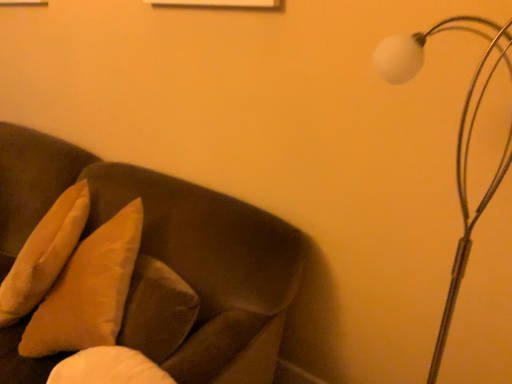
Question: Considering the relative sizes of white matte lamp at upper right and soft beige pillow at left in the image provided, is white matte lamp at upper right wider than soft beige pillow at left?

Choices:
 (A) yes
 (B) no

Answer: (B)

Question: From a real-world perspective, does white matte lamp at upper right sit lower than soft beige pillow at left?

Choices:
 (A) yes
 (B) no

Answer: (B)

Question: Is white matte lamp at upper right completely or partially outside of soft beige pillow at left?

Choices:
 (A) no
 (B) yes

Answer: (B)

Question: Does white matte lamp at upper right touch soft beige pillow at left?

Choices:
 (A) no
 (B) yes

Answer: (A)

Question: Is white matte lamp at upper right thinner than soft beige pillow at left?

Choices:
 (A) no
 (B) yes

Answer: (B)

Question: Is point (30, 244) closer or farther from the camera than point (241, 231)?

Choices:
 (A) closer
 (B) farther

Answer: (B)

Question: Is soft beige pillow at left inside or outside of suede-like brown couch at left?

Choices:
 (A) inside
 (B) outside

Answer: (A)

Question: In terms of size, does soft beige pillow at left appear bigger or smaller than suede-like brown couch at left?

Choices:
 (A) small
 (B) big

Answer: (A)

Question: In the image, is soft beige pillow at left positioned in front of or behind suede-like brown couch at left?

Choices:
 (A) front
 (B) behind

Answer: (B)

Question: Does point (462, 256) appear closer or farther from the camera than point (187, 220)?

Choices:
 (A) closer
 (B) farther

Answer: (A)

Question: In terms of height, does white matte lamp at upper right look taller or shorter compared to suede-like brown couch at left?

Choices:
 (A) short
 (B) tall

Answer: (B)

Question: Choose the correct answer: Is white matte lamp at upper right inside suede-like brown couch at left or outside it?

Choices:
 (A) inside
 (B) outside

Answer: (B)

Question: From the image's perspective, relative to suede-like brown couch at left, is white matte lamp at upper right above or below?

Choices:
 (A) above
 (B) below

Answer: (A)

Question: Looking at the image, does white matte lamp at upper right seem bigger or smaller compared to soft beige pillow at left?

Choices:
 (A) big
 (B) small

Answer: (B)

Question: In terms of width, does white matte lamp at upper right look wider or thinner when compared to soft beige pillow at left?

Choices:
 (A) thin
 (B) wide

Answer: (A)